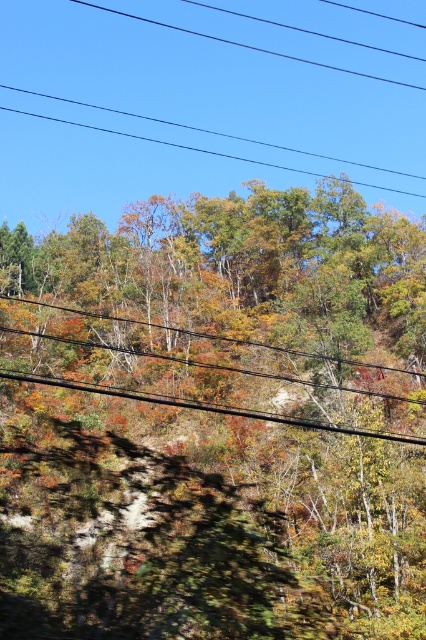
Question: Does autumn leaves at upper center lie behind black wire at center?

Choices:
 (A) yes
 (B) no

Answer: (B)

Question: Does autumn leaves at upper center come in front of black wire at center?

Choices:
 (A) yes
 (B) no

Answer: (A)

Question: Estimate the real-world distances between objects in this image. Which object is closer to the autumn leaves at upper center?

Choices:
 (A) black wire at center
 (B) black wire at upper center

Answer: (A)

Question: Which object is farther from the camera taking this photo?

Choices:
 (A) black wire at upper center
 (B) autumn leaves at upper center
 (C) black wire at center

Answer: (A)

Question: Which of the following is the farthest from the observer?

Choices:
 (A) (138, 394)
 (B) (268, 353)
 (C) (368, 182)

Answer: (C)

Question: Is autumn leaves at upper center thinner than black wire at center?

Choices:
 (A) no
 (B) yes

Answer: (A)